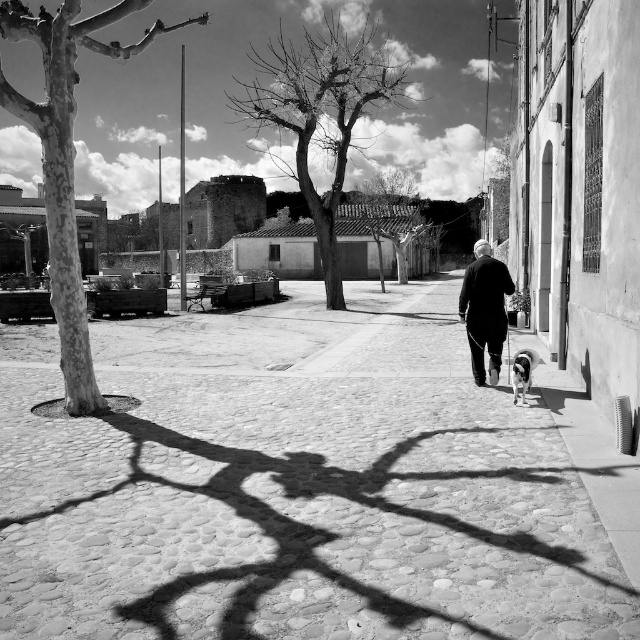
Question: Which is nearer to the smooth bark tree at center?

Choices:
 (A) dark gray wool coat at center
 (B) cobblestone pavement at center
 (C) white fur dog at lower right

Answer: (B)

Question: Considering the relative positions of smooth bark tree at left and white fur dog at lower right in the image provided, where is smooth bark tree at left located with respect to white fur dog at lower right?

Choices:
 (A) right
 (B) left

Answer: (B)

Question: Which object is closer to the camera taking this photo?

Choices:
 (A) white fur dog at lower right
 (B) dark gray wool coat at center
 (C) cobblestone pavement at center
 (D) smooth bark tree at left

Answer: (C)

Question: Can you confirm if cobblestone pavement at center is positioned above white fur dog at lower right?

Choices:
 (A) no
 (B) yes

Answer: (B)

Question: Observing the image, what is the correct spatial positioning of bare wood tree at center in reference to dark gray wool coat at center?

Choices:
 (A) above
 (B) below

Answer: (A)

Question: Which object is farther from the camera taking this photo?

Choices:
 (A) smooth bark tree at center
 (B) smooth bark tree at left
 (C) cobblestone pavement at center
 (D) white fur dog at lower right

Answer: (A)